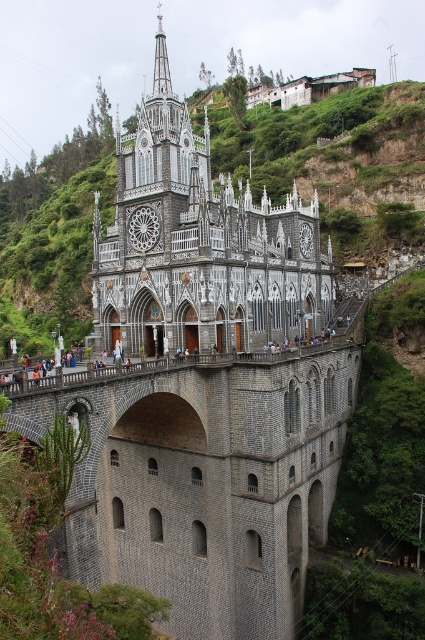
Question: Can you confirm if gray stone bridge at center is smaller than gray stone tower at center?

Choices:
 (A) yes
 (B) no

Answer: (A)

Question: Does gray stone bridge at center appear under gray stone tower at center?

Choices:
 (A) no
 (B) yes

Answer: (B)

Question: Which point is farther to the camera?

Choices:
 (A) (129, 440)
 (B) (184, 284)

Answer: (A)

Question: Where is gray stone bridge at center located in relation to gray stone tower at center in the image?

Choices:
 (A) left
 (B) right

Answer: (B)

Question: Which of the following is the closest to the observer?

Choices:
 (A) (260, 228)
 (B) (224, 493)

Answer: (B)

Question: Which point appears closest to the camera in this image?

Choices:
 (A) (272, 282)
 (B) (175, 552)

Answer: (B)